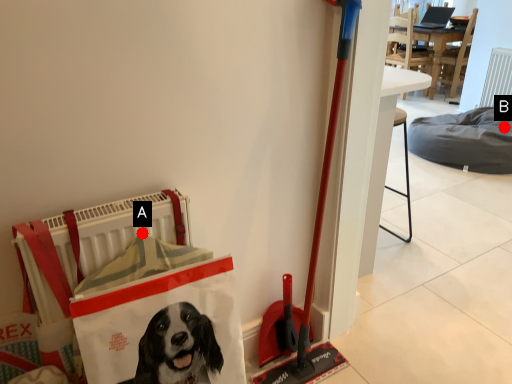
Question: Two points are circled on the image, labeled by A and B beside each circle. Which point is closer to the camera?

Choices:
 (A) A is closer
 (B) B is closer

Answer: (A)